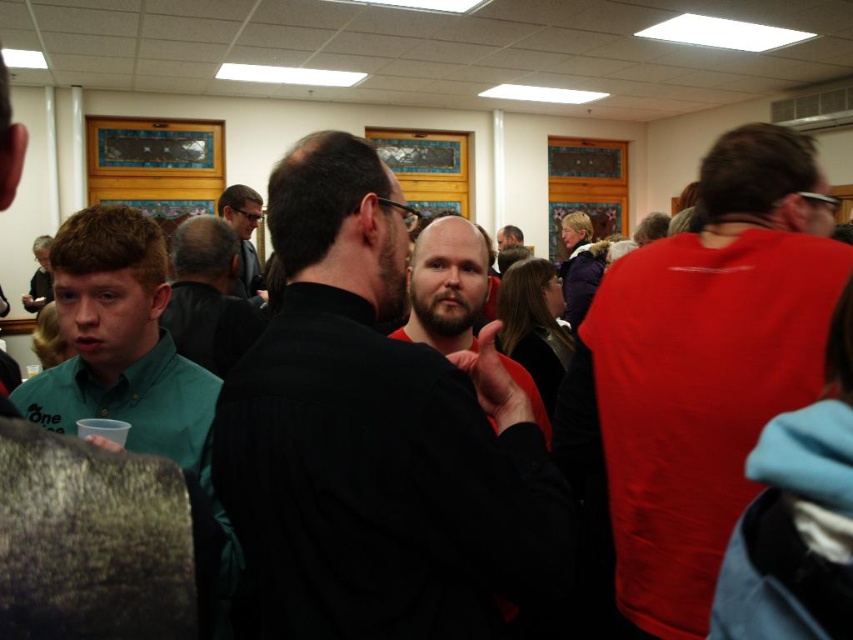
Question: Based on their relative distances, which object is nearer to the matte black shirt at left?

Choices:
 (A) dark brown leather jacket at center
 (B) matte red shirt at right

Answer: (A)

Question: Does matte red shirt at right appear on the right side of dark brown leather jacket at center?

Choices:
 (A) no
 (B) yes

Answer: (B)

Question: Which point is farther to the camera?

Choices:
 (A) (138, 378)
 (B) (514, 243)
 (C) (434, 291)

Answer: (B)

Question: Among these points, which one is nearest to the camera?

Choices:
 (A) pos(509,232)
 (B) pos(122,316)
 (C) pos(194,237)

Answer: (B)

Question: Does black matte shirt at center come in front of matte black beard at center?

Choices:
 (A) no
 (B) yes

Answer: (B)

Question: Does bearded man at center have a greater width compared to dark brown leather jacket at center?

Choices:
 (A) yes
 (B) no

Answer: (B)